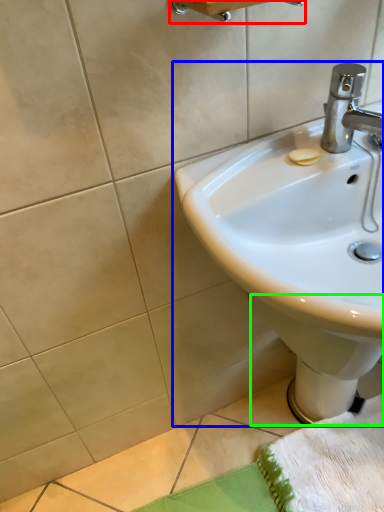
Question: Which object is the closest to the towel bar (highlighted by a red box)? Choose among these: sink (highlighted by a blue box) or bidet (highlighted by a green box).

Choices:
 (A) sink
 (B) bidet

Answer: (A)